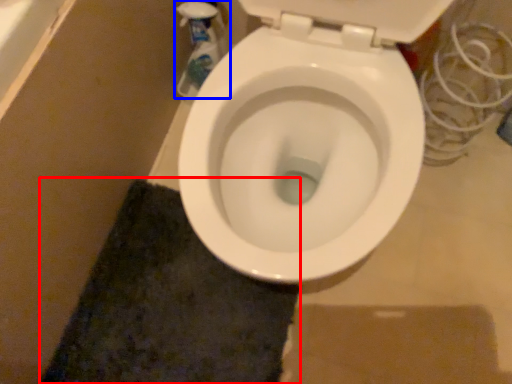
Question: Which object is further to the camera taking this photo, bath mat (highlighted by a red box) or cleaning product (highlighted by a blue box)?

Choices:
 (A) bath mat
 (B) cleaning product

Answer: (B)